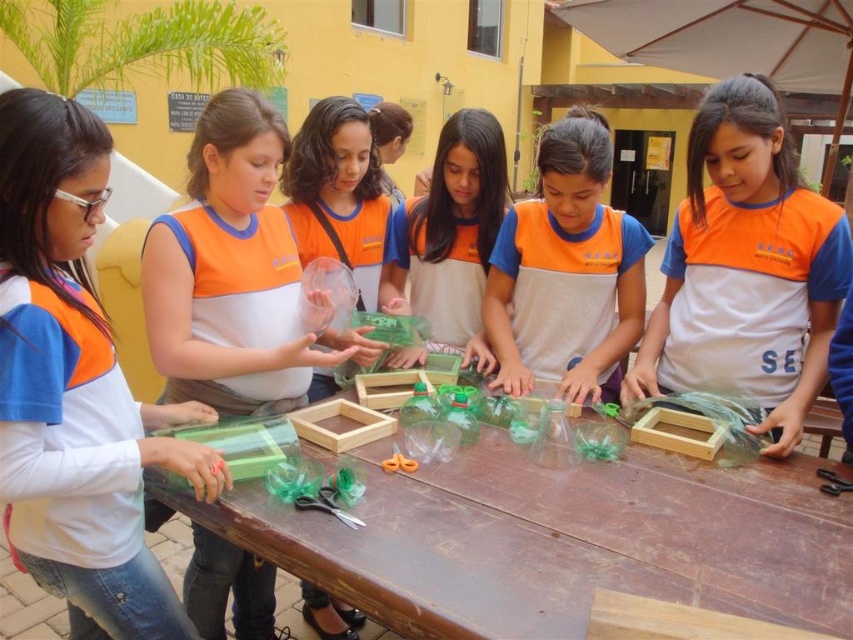
Question: Which point is closer to the camera?

Choices:
 (A) matte orange vest at center
 (B) orange fabric shirt at center
 (C) orange plastic scissors at center
 (D) translucent plastic container at center

Answer: (C)

Question: Is matte orange vest at center to the right of translucent plastic container at center from the viewer's perspective?

Choices:
 (A) yes
 (B) no

Answer: (A)

Question: Considering the real-world distances, which object is closest to the translucent plastic container at center?

Choices:
 (A) translucent plastic bottle at center
 (B) brown wooden table at center
 (C) white matte shirt at upper left
 (D) orange fabric shirt at center

Answer: (A)

Question: Is translucent plastic bottle at center positioned at the back of orange fabric shirt at center?

Choices:
 (A) yes
 (B) no

Answer: (A)

Question: Is orange fabric shirt at center in front of translucent plastic container at center?

Choices:
 (A) no
 (B) yes

Answer: (B)

Question: Which point is closer to the camera?

Choices:
 (A) pos(245,116)
 (B) pos(413,470)

Answer: (B)